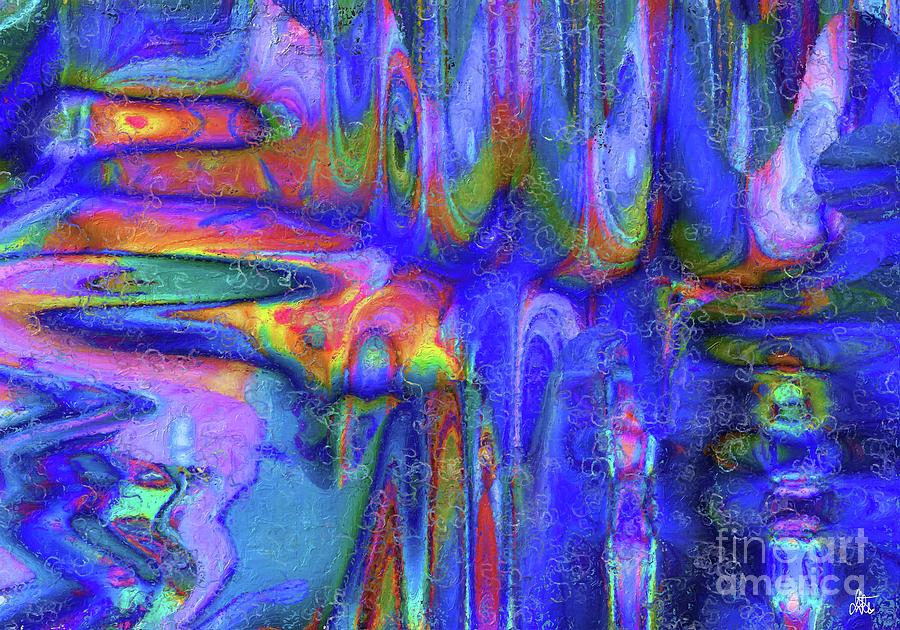
You are a GUI agent. You are given a task and a screenshot of the screen. Output one action in this format:
    pyautogui.click(x=<x>, y=<y>)
    Task: Click on the art
    The height and width of the screenshot is (630, 900).
    Given the screenshot: What is the action you would take?
    pyautogui.click(x=851, y=547)